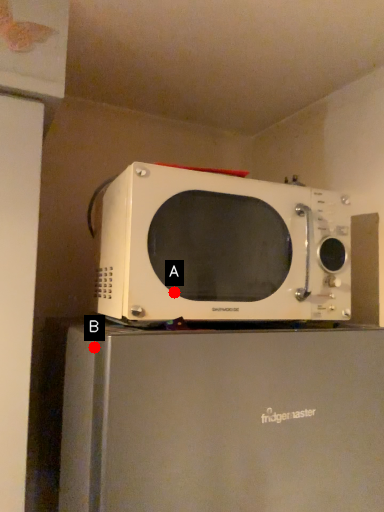
Question: Two points are circled on the image, labeled by A and B beside each circle. Which point appears closest to the camera in this image?

Choices:
 (A) A is closer
 (B) B is closer

Answer: (B)